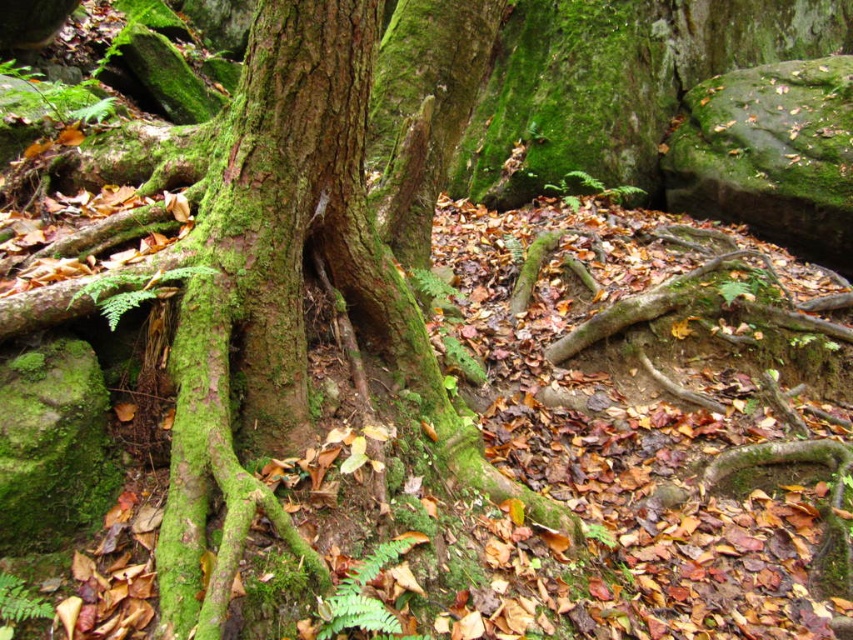
You are a hiker who wants to take a photo of both the green mossy tree trunk at center and the green matte fern at center. Since you have a camera with a fixed focal length, you need to know which one is taller to adjust the focus. Can you tell me which one is taller?

The green mossy tree trunk at center is much taller as the green matte fern at center, so you should focus on the green mossy tree trunk at center first.

Consider the image. You are a hiker who wants to cross a stream using the green mossy tree roots at center and the green mossy tree trunk at center. Which structure is taller and would provide a better vantage point to see across the stream?

The green mossy tree roots at center is much taller than the green mossy tree trunk at center, so it would provide a better vantage point to see across the stream.

You are a small animal trying to cross from the green mossy tree trunk at center to the green matte fern at center. Can you fit through the space between them without squeezing?

The green mossy tree trunk at center and green matte fern at center are 15.14 inches apart from each other, so yes, the small animal can fit through the space between them without needing to squeeze.